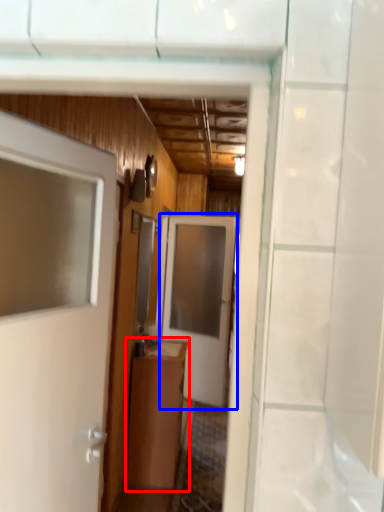
Question: Which object appears closest to the camera in this image, cabinetry (highlighted by a red box) or door (highlighted by a blue box)?

Choices:
 (A) cabinetry
 (B) door

Answer: (A)